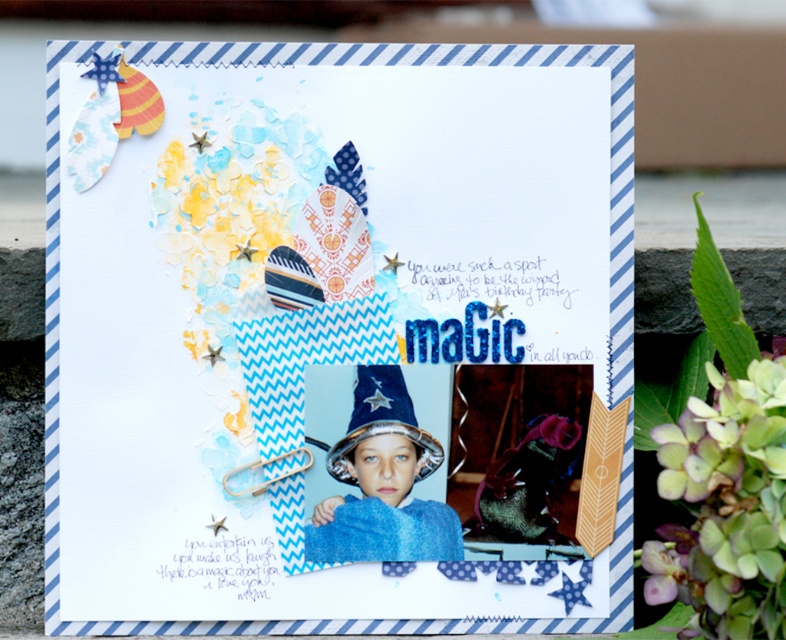
You are arranging a magical themed party and have placed the green matte hydrangea at upper right and the shiny silver wizard hat at center on a table. If you want to move the wizard hat closer to the hydrangea, which direction should you move it?

You should move the shiny silver wizard hat at center to the right to place it closer to the green matte hydrangea at upper right since the green matte hydrangea at upper right is to the right of the shiny silver wizard hat at center.

You are a scrapbook designer trying to add a new sticker. You need to know which object is closer to you between the matte blue wizard hat at center and the green matte hydrangea at upper right. Can you tell me?

The matte blue wizard hat at center is closer to you than the green matte hydrangea at upper right.